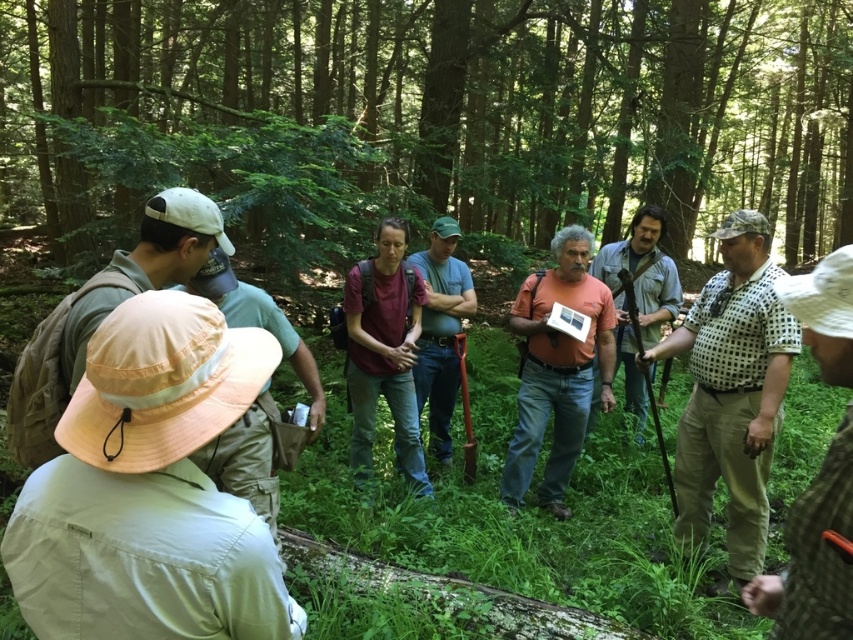
You are a photographer trying to capture a candid shot of the orange matte shirt at center without being noticed. You have a camera with a 4 meter focal length lens. Can you take the photo from your current position?

The orange matte shirt at center and camera are 4.28 meters apart. Since the focal length is 4 meters, you are slightly too far to capture the shirt clearly without moving closer.

You are standing in the forest and see a group of people. There is a point marked at coordinates (461, 104). What object in the scene is located at that point?

The point at coordinates (461, 104) corresponds to the green leafy tree at center.

You are a photographer trying to capture a group photo of the orange matte shirt at center and the matte brown shirt at center. Since you want both shirts to be visible, which shirt should you position your camera to the left of to ensure both are in frame?

The orange matte shirt at center is positioned on the right side of matte brown shirt at center. To include both shirts in the frame, position the camera to the left of the orange matte shirt at center so that the matte brown shirt at center is on the left and the orange matte shirt at center is on the right within the camera view.